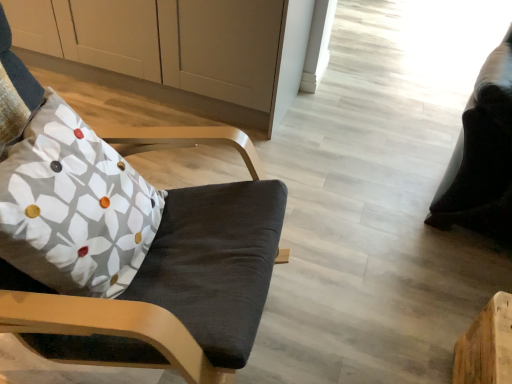
Question: Is black leather bean bag chair at right closer to the viewer compared to floral fabric pillow at left?

Choices:
 (A) yes
 (B) no

Answer: (B)

Question: From the image's perspective, is black leather bean bag chair at right located above floral fabric pillow at left?

Choices:
 (A) yes
 (B) no

Answer: (A)

Question: Does black leather bean bag chair at right have a lesser height compared to floral fabric pillow at left?

Choices:
 (A) no
 (B) yes

Answer: (A)

Question: Is floral fabric pillow at left a part of black leather bean bag chair at right?

Choices:
 (A) yes
 (B) no

Answer: (B)

Question: From a real-world perspective, is black leather bean bag chair at right under floral fabric pillow at left?

Choices:
 (A) yes
 (B) no

Answer: (A)

Question: Is black leather bean bag chair at right located outside floral fabric pillow at left?

Choices:
 (A) no
 (B) yes

Answer: (B)

Question: Is white matte cabinet at upper left outside floral fabric pillow at left?

Choices:
 (A) yes
 (B) no

Answer: (A)

Question: Can you confirm if white matte cabinet at upper left is bigger than floral fabric pillow at left?

Choices:
 (A) no
 (B) yes

Answer: (B)

Question: Considering the relative sizes of white matte cabinet at upper left and floral fabric pillow at left in the image provided, is white matte cabinet at upper left taller than floral fabric pillow at left?

Choices:
 (A) no
 (B) yes

Answer: (B)

Question: Is white matte cabinet at upper left to the right of floral fabric pillow at left from the viewer's perspective?

Choices:
 (A) yes
 (B) no

Answer: (B)

Question: Is white matte cabinet at upper left positioned with its back to floral fabric pillow at left?

Choices:
 (A) no
 (B) yes

Answer: (A)

Question: From the image's perspective, is white matte cabinet at upper left over floral fabric pillow at left?

Choices:
 (A) no
 (B) yes

Answer: (B)

Question: From the image's perspective, is floral fabric pillow at left located above black leather bean bag chair at right?

Choices:
 (A) no
 (B) yes

Answer: (A)